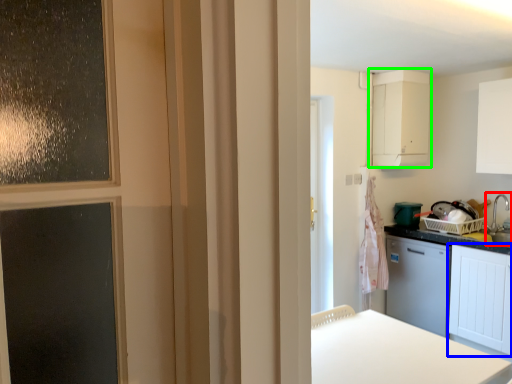
Question: Which object is positioned farthest from sink (highlighted by a red box)? Select from cabinetry (highlighted by a blue box) and cabinetry (highlighted by a green box).

Choices:
 (A) cabinetry
 (B) cabinetry

Answer: (B)